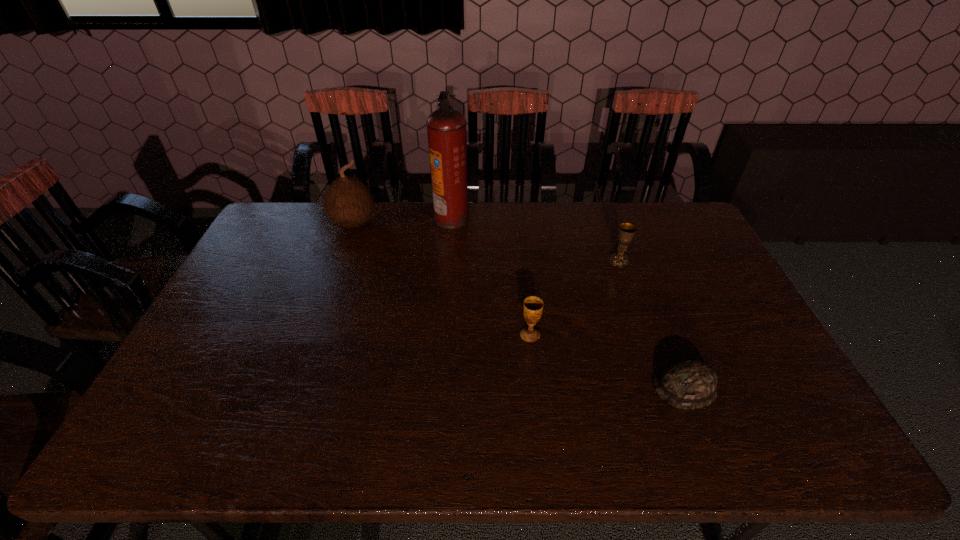
Identify the location of free location that satisfies the following two spatial constraints: 1. at the nozzle of the tallest object; 2. on the surface of the fourth shortest object. (451, 222).

The image size is (960, 540). Identify the location of vacant area that satisfies the following two spatial constraints: 1. on the front side of the headwear; 2. on the right side of the right chalice. (663, 387).

The image size is (960, 540). What are the coordinates of `blank space that satisfies the following two spatial constraints: 1. at the nozzle of the third object from left to right; 2. on the left side of the fire extinguisher` in the screenshot? It's located at (443, 335).

What are the coordinates of `vacant position in the image that satisfies the following two spatial constraints: 1. at the nozzle of the nearer chalice; 2. on the left side of the second object from left to right` in the screenshot? It's located at (443, 335).

Identify the location of vacant space that satisfies the following two spatial constraints: 1. on the surface of the coconut; 2. on the right side of the headwear. The image size is (960, 540). (296, 387).

At what (x,y) coordinates should I click in order to perform the action: click on vacant space that satisfies the following two spatial constraints: 1. at the nozzle of the shortest object; 2. on the right side of the fire extinguisher. Please return your answer as a coordinate pair (x, y). Looking at the image, I should click on tap(438, 387).

At what (x,y) coordinates should I click in order to perform the action: click on vacant region that satisfies the following two spatial constraints: 1. on the back side of the third nearest object; 2. at the nozzle of the second object from left to right. Please return your answer as a coordinate pair (x, y). The image size is (960, 540). Looking at the image, I should click on (604, 218).